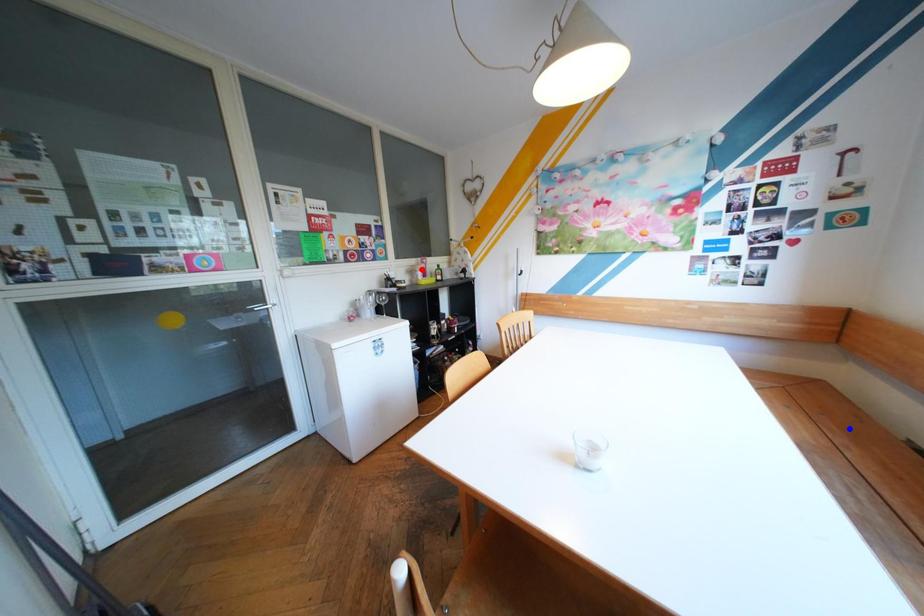
Question: In the image, two points are highlighted. Which point is nearer to the camera? Reply with the corresponding letter.

Choices:
 (A) blue point
 (B) red point

Answer: (A)